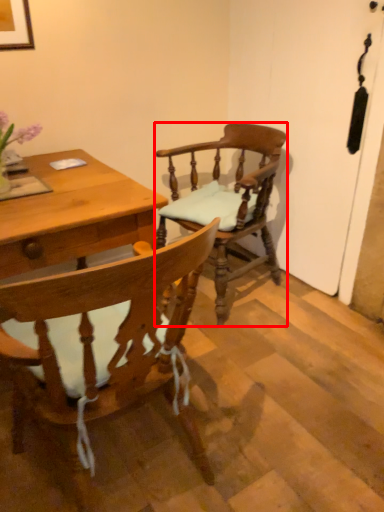
Question: In this image, where is chair (annotated by the red box) located relative to chair?

Choices:
 (A) left
 (B) right

Answer: (B)